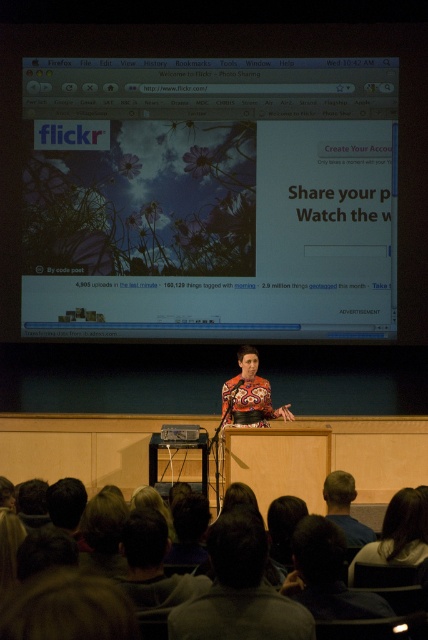
Question: Based on their relative distances, which object is nearer to the dark brown hair at lower right?

Choices:
 (A) dark gray hair at lower center
 (B) metallic projector at center

Answer: (A)

Question: Does white glossy screen at upper center lie in front of blue shirt at lower right?

Choices:
 (A) no
 (B) yes

Answer: (A)

Question: Is white glossy screen at upper center to the left of printed fabric dress at center from the viewer's perspective?

Choices:
 (A) no
 (B) yes

Answer: (B)

Question: Which object is positioned closest to the dark hair at lower center?

Choices:
 (A) printed fabric dress at center
 (B) white glossy screen at upper center

Answer: (A)

Question: Does dark hair at lower center have a larger size compared to blue shirt at lower right?

Choices:
 (A) yes
 (B) no

Answer: (A)

Question: Which of the following is the closest to the observer?

Choices:
 (A) blue shirt at lower right
 (B) printed fabric dress at center
 (C) metallic projector at center

Answer: (A)